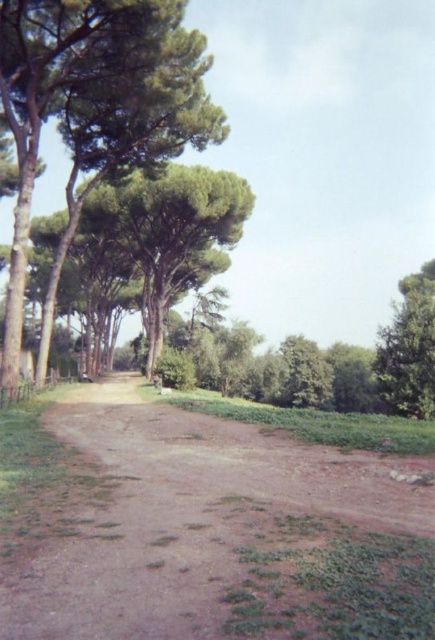
Looking at this image, can you confirm if green leafy tree at left is positioned to the right of green leafy tree at right?

Incorrect, green leafy tree at left is not on the right side of green leafy tree at right.

Between point (17, 240) and point (392, 344), which one is positioned in front?

Point (17, 240) is more forward.

You are a GUI agent. You are given a task and a screenshot of the screen. Output one action in this format:
    pyautogui.click(x=<x>, y=<y>)
    Task: Click on the green leafy tree at left
    
    Given the screenshot: What is the action you would take?
    pyautogui.click(x=96, y=97)

Can you confirm if brown dirt track at center is shorter than green leafy tree at right?

Indeed, brown dirt track at center has a lesser height compared to green leafy tree at right.

Between brown dirt track at center and green leafy tree at right, which one appears on the right side from the viewer's perspective?

From the viewer's perspective, green leafy tree at right appears more on the right side.

Is point (151, 544) farther from camera compared to point (400, 316)?

No, (151, 544) is in front of (400, 316).

Where is `brown dirt track at center`? Image resolution: width=435 pixels, height=640 pixels. brown dirt track at center is located at coordinates (203, 528).

Does point (22, 621) come behind point (91, 48)?

No, (22, 621) is closer to viewer.

Is brown dirt track at center taller than green leafy tree at left?

Incorrect, brown dirt track at center's height is not larger of green leafy tree at left's.

Does point (47, 435) come behind point (134, 109)?

That is False.

Locate an element on the screen. The image size is (435, 640). brown dirt track at center is located at coordinates [x=203, y=528].